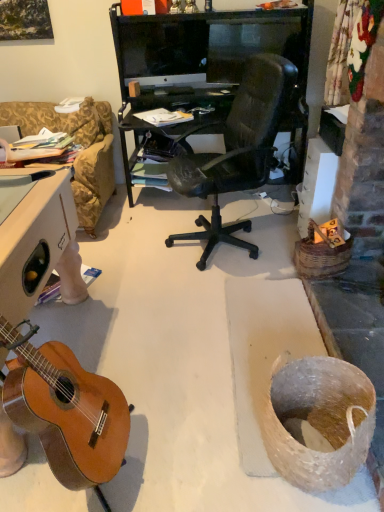
At what (x,y) coordinates should I click in order to perform the action: click on spots to the right of natural wood guitar at lower left. Please return your answer as a coordinate pair (x, y). The width and height of the screenshot is (384, 512). Looking at the image, I should click on (187, 445).